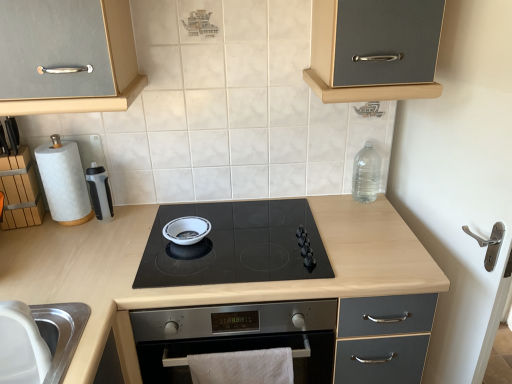
Locate an element on the screen. vacant space that is to the left of clear plastic bottle at upper right is located at coordinates (329, 207).